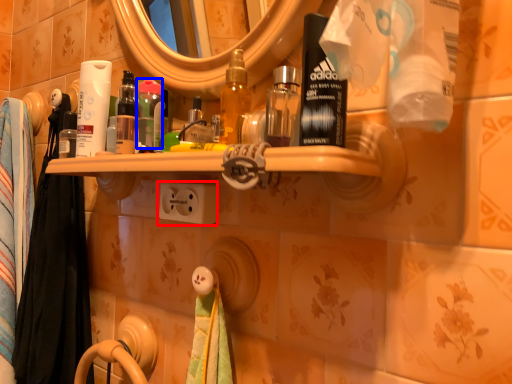
Question: Which object is further to the camera taking this photo, electric outlet (highlighted by a red box) or mouthwash (highlighted by a blue box)?

Choices:
 (A) electric outlet
 (B) mouthwash

Answer: (B)